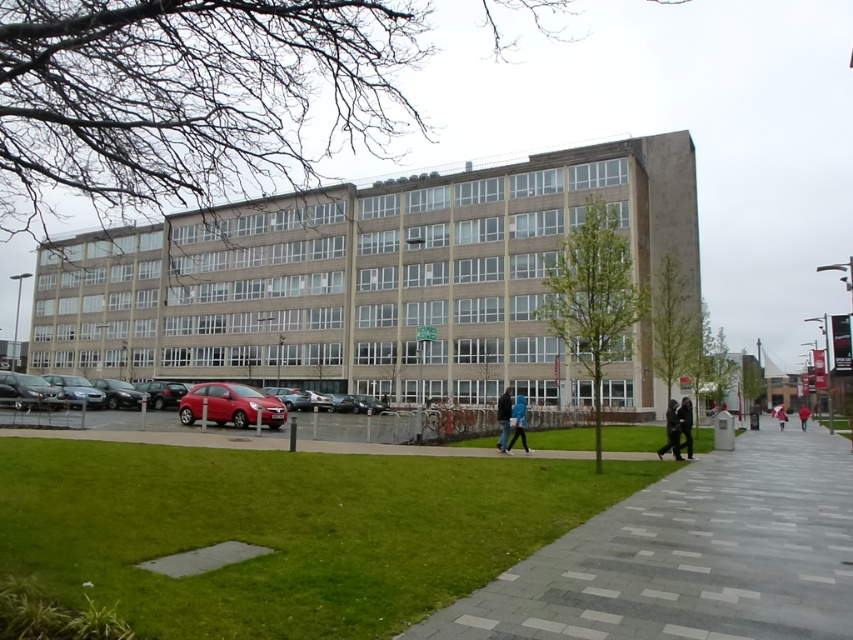
Question: Estimate the real-world distances between objects in this image. Which object is closer to the gray concrete pavement at lower right?

Choices:
 (A) matte red hatchback at lower left
 (B) dark blue jeans at center

Answer: (B)

Question: Does glossy red hatchback at lower left appear over matte silver car at lower left?

Choices:
 (A) yes
 (B) no

Answer: (A)

Question: Which of these objects is positioned closest to the red jacket at center?

Choices:
 (A) matte red hatchback at lower left
 (B) dark gray hoodie at lower right

Answer: (B)

Question: Can you confirm if glossy red hatchback at lower left is wider than blue fabric jacket at center?

Choices:
 (A) yes
 (B) no

Answer: (B)

Question: Which object is farther from the camera taking this photo?

Choices:
 (A) shiny silver sedan at lower left
 (B) dark gray fabric jacket at lower right

Answer: (A)

Question: Can you confirm if shiny silver sedan at lower left is thinner than dark blue jeans at center?

Choices:
 (A) no
 (B) yes

Answer: (A)